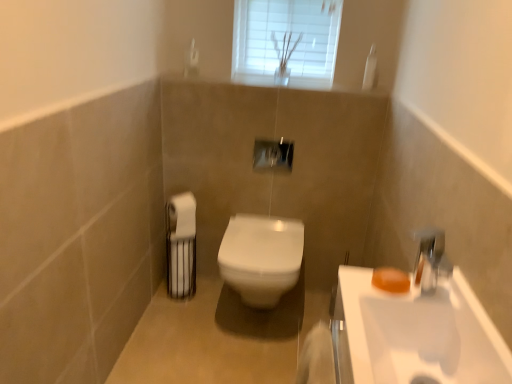
At what (x,y) coordinates should I click in order to perform the action: click on free space to the left of chrome metallic faucet at upper right. Please return your answer as a coordinate pair (x, y). Image resolution: width=512 pixels, height=384 pixels. Looking at the image, I should click on (379, 285).